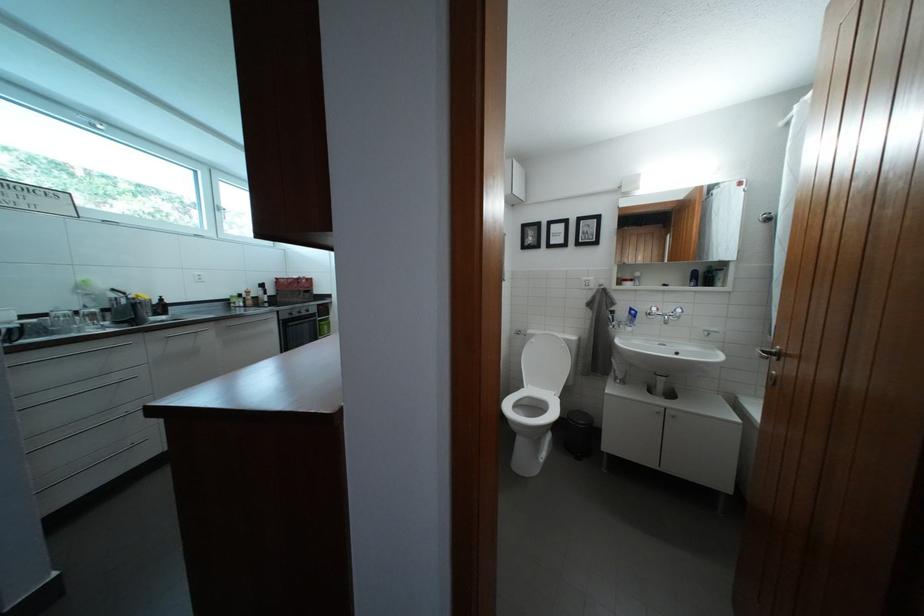
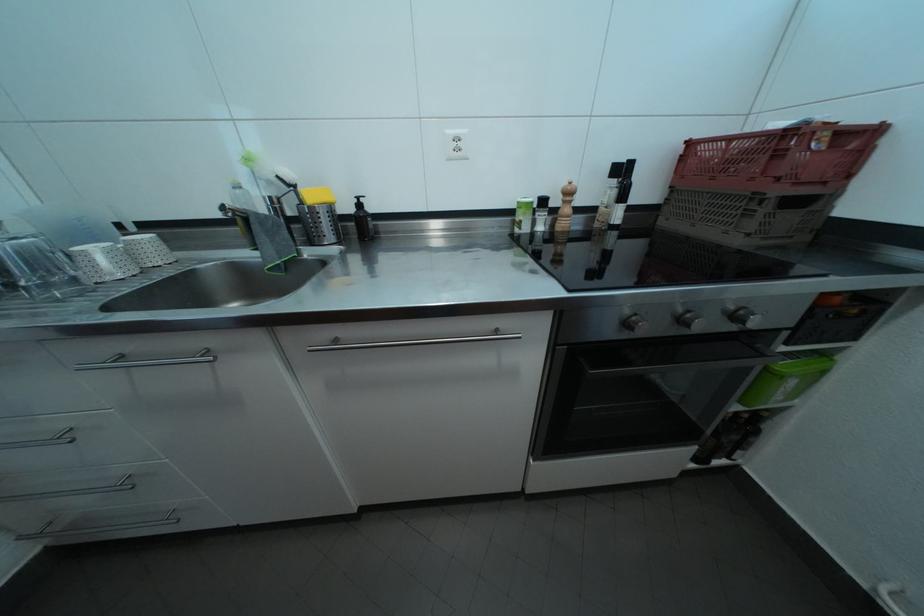
Where in the second image is the point corresponding to pixel 335 326 from the first image?

(833, 360)